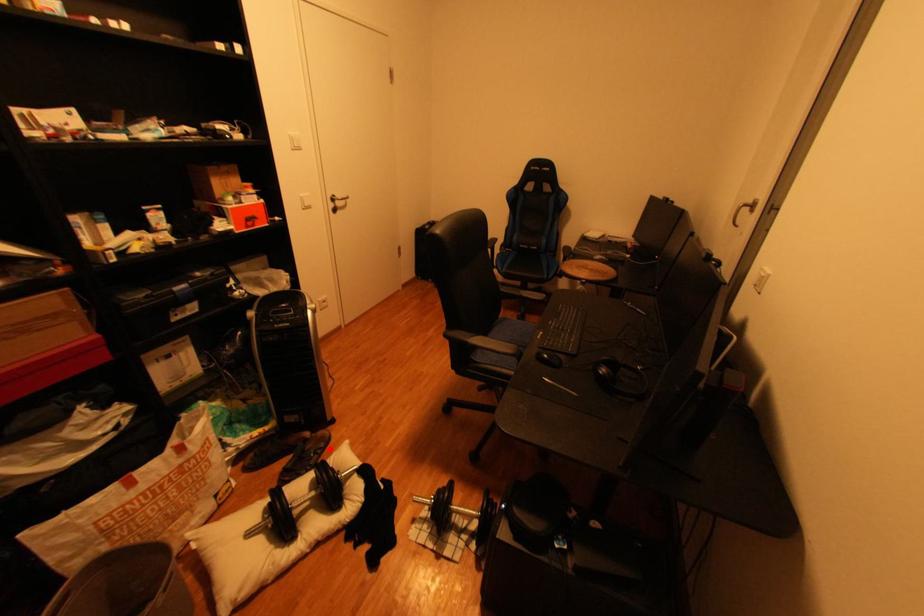
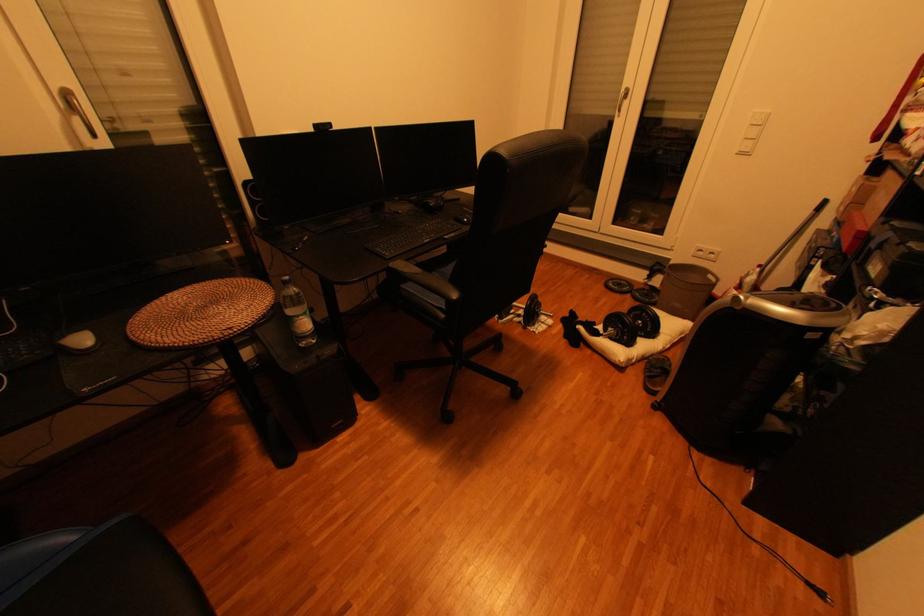
Where in the second image is the point corresponding to the highlighted location from the first image?

(658, 373)